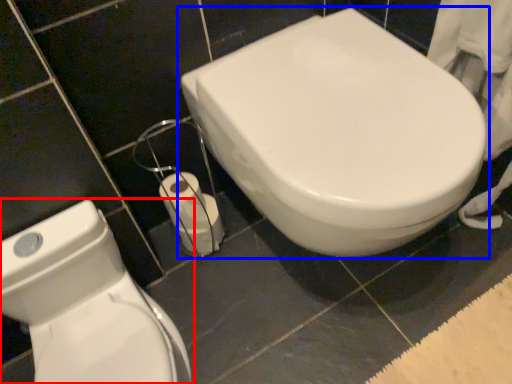
Question: Which object appears farthest to the camera in this image, toilet (highlighted by a red box) or toilet (highlighted by a blue box)?

Choices:
 (A) toilet
 (B) toilet

Answer: (B)